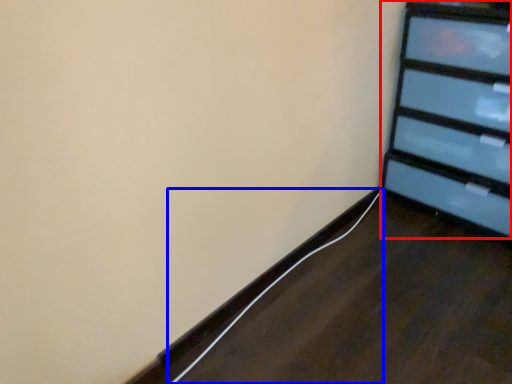
Question: Which object is closer to the camera taking this photo, furniture (highlighted by a red box) or cable (highlighted by a blue box)?

Choices:
 (A) furniture
 (B) cable

Answer: (A)